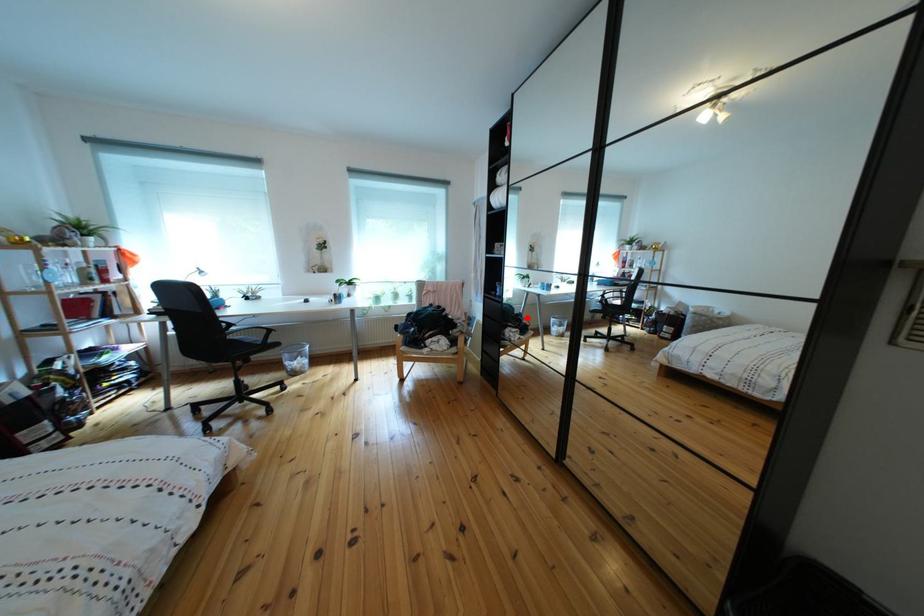
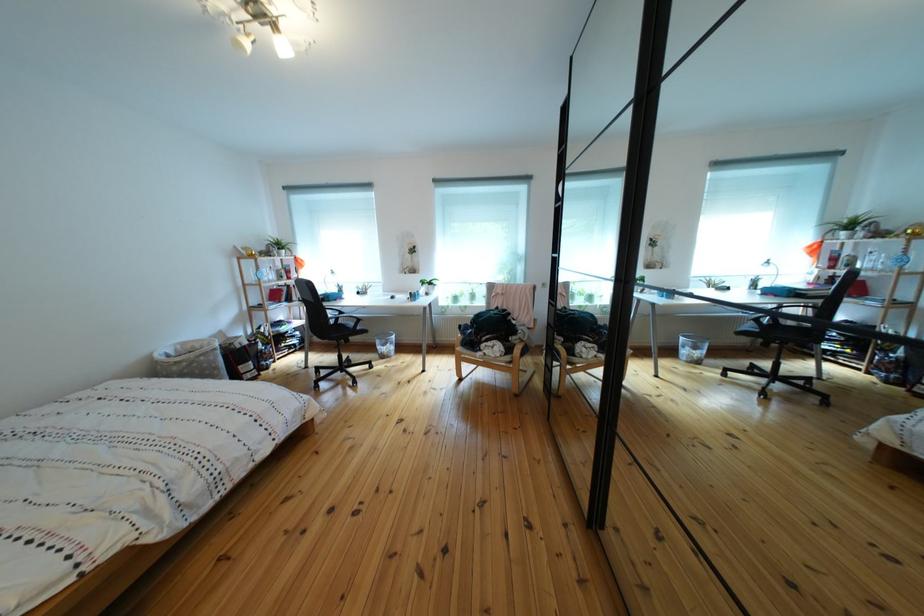
Where in the second image is the point corresponding to the highlighted location from the first image?

(613, 329)